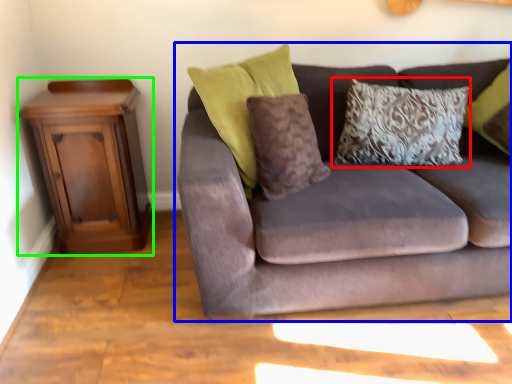
Question: Which object is positioned closest to pillow (highlighted by a red box)? Select from studio couch (highlighted by a blue box) and nightstand (highlighted by a green box).

Choices:
 (A) studio couch
 (B) nightstand

Answer: (A)